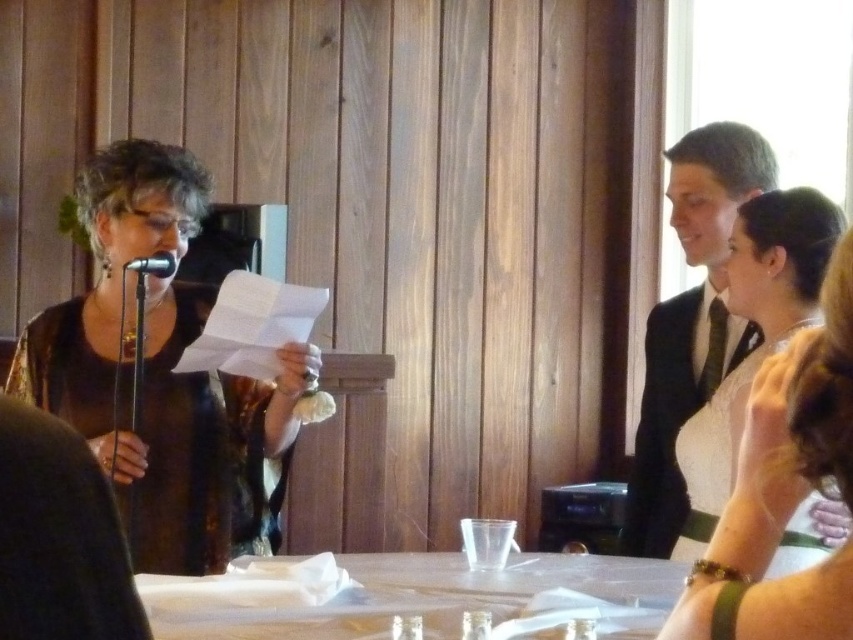
Looking at this image, does matte black dress at left have a greater height compared to black satin suit at right?

No.

Is matte black dress at left thinner than black satin suit at right?

Incorrect, matte black dress at left's width is not less than black satin suit at right's.

Between point (114, 188) and point (709, 337), which one is positioned in front?

Point (114, 188) is in front.

I want to click on matte black dress at left, so click(x=161, y=376).

Which is in front, point (631, 472) or point (590, 593)?

Point (590, 593)

In the scene shown: Which is more to the left, black satin suit at right or white paper napkin at center?

From the viewer's perspective, white paper napkin at center appears more on the left side.

Between point (700, 128) and point (260, 624), which one is positioned in front?

Point (260, 624)

This screenshot has width=853, height=640. Identify the location of black satin suit at right. (691, 323).

From the picture: Can you confirm if white satin dress at upper right is positioned to the right of black metallic microphone at left?

Correct, you'll find white satin dress at upper right to the right of black metallic microphone at left.

Can you confirm if white satin dress at upper right is shorter than black metallic microphone at left?

No, white satin dress at upper right is not shorter than black metallic microphone at left.

The width and height of the screenshot is (853, 640). What do you see at coordinates (759, 444) in the screenshot?
I see `white satin dress at upper right` at bounding box center [759, 444].

At what (x,y) coordinates should I click in order to perform the action: click on white satin dress at upper right. Please return your answer as a coordinate pair (x, y). The height and width of the screenshot is (640, 853). Looking at the image, I should click on (759, 444).